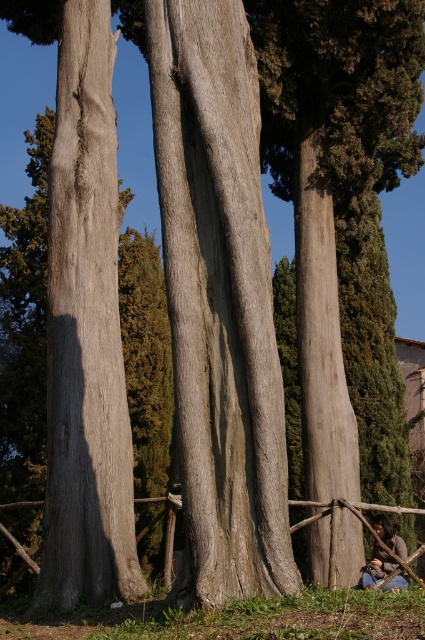
Which of these two, gray rough bark tree trunk at center or smooth gray tree trunk at center, stands taller?

smooth gray tree trunk at center is taller.

Is gray rough bark tree trunk at center closer to the viewer compared to smooth gray tree trunk at center?

Yes, gray rough bark tree trunk at center is in front of smooth gray tree trunk at center.

Find the location of a particular element. This screenshot has height=640, width=425. gray rough bark tree trunk at center is located at coordinates (220, 300).

Who is taller, wooden at center or dark brown leather jacket at lower right?

Standing taller between the two is dark brown leather jacket at lower right.

Which of these two, wooden at center or dark brown leather jacket at lower right, stands shorter?

Standing shorter between the two is wooden at center.

Measure the distance between point (379,584) and camera.

Point (379,584) and camera are 11.27 meters apart.

Image resolution: width=425 pixels, height=640 pixels. In order to click on wooden at center in this screenshot , I will do 350,509.

Who is more forward, (56,276) or (357,499)?

Positioned in front is point (56,276).

From the picture: Measure the distance between gray rough bark tree trunk at left and camera.

30.33 feet

You are a GUI agent. You are given a task and a screenshot of the screen. Output one action in this format:
    pyautogui.click(x=<x>, y=<y>)
    Task: Click on the gray rough bark tree trunk at left
    The image size is (425, 640).
    Given the screenshot: What is the action you would take?
    click(x=85, y=332)

Where is `gray rough bark tree trunk at left`? The height and width of the screenshot is (640, 425). gray rough bark tree trunk at left is located at coordinates (85, 332).